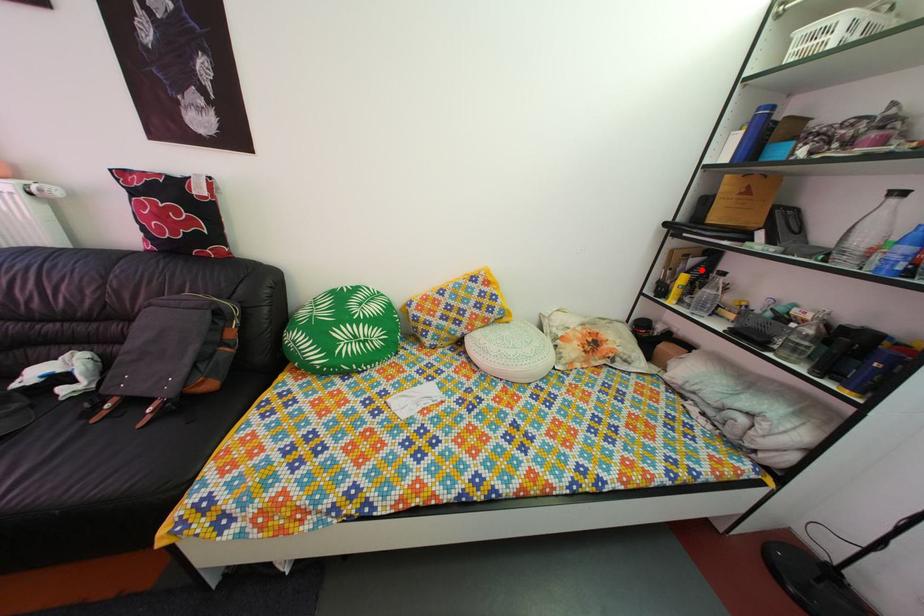
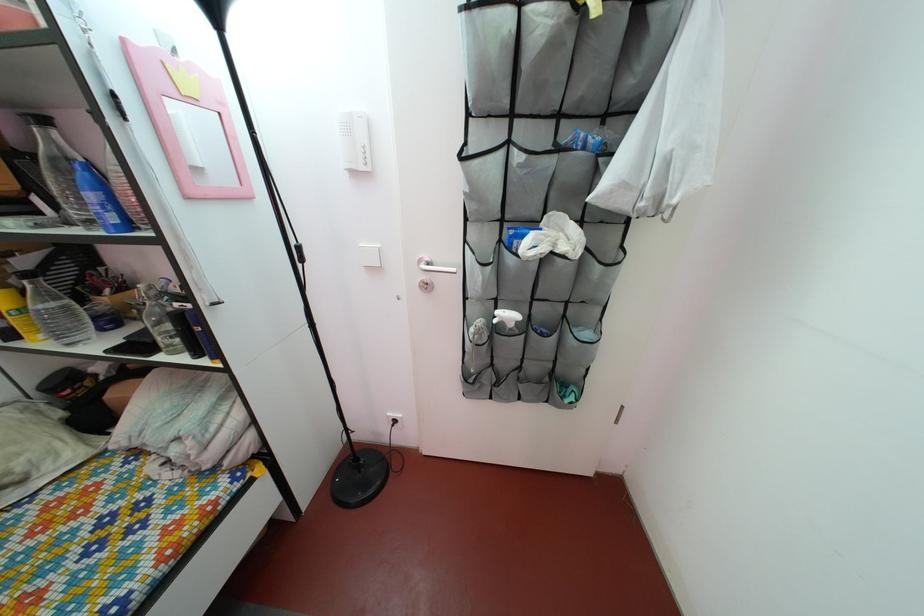
In the second image, find the point that corresponds to the highlighted location in the first image.

(32, 270)